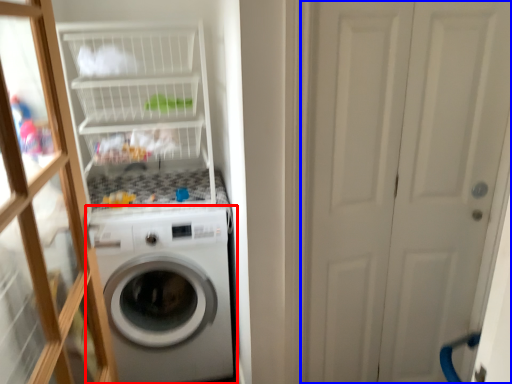
Question: Which of the following is the closest to the observer, washing machine (highlighted by a red box) or screen door (highlighted by a blue box)?

Choices:
 (A) washing machine
 (B) screen door

Answer: (B)